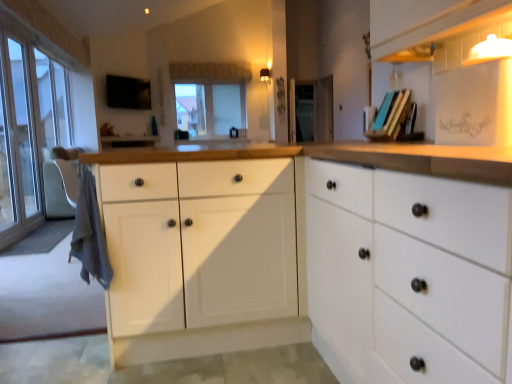
Question: Which direction should I rotate to look at matte black knob at center, which is counted as the third knob, starting from the top?

Choices:
 (A) right
 (B) left

Answer: (A)

Question: Is transparent glass door at left far away from transparent glass screen door at center?

Choices:
 (A) no
 (B) yes

Answer: (B)

Question: Does transparent glass door at left come in front of transparent glass screen door at center?

Choices:
 (A) yes
 (B) no

Answer: (A)

Question: From the image's perspective, is transparent glass door at left on top of transparent glass screen door at center?

Choices:
 (A) no
 (B) yes

Answer: (A)

Question: From the image's perspective, would you say transparent glass door at left is shown under transparent glass screen door at center?

Choices:
 (A) no
 (B) yes

Answer: (B)

Question: Could transparent glass screen door at center be considered to be inside transparent glass door at left?

Choices:
 (A) no
 (B) yes

Answer: (A)

Question: Considering the relative sizes of transparent glass door at left and transparent glass screen door at center in the image provided, is transparent glass door at left bigger than transparent glass screen door at center?

Choices:
 (A) no
 (B) yes

Answer: (B)

Question: Is the surface of metallic black knob at center, which is the first knob in top-to-bottom order, in direct contact with transparent glass door at left?

Choices:
 (A) no
 (B) yes

Answer: (A)

Question: Is metallic black knob at center, which is the first knob in top-to-bottom order, positioned before transparent glass door at left?

Choices:
 (A) yes
 (B) no

Answer: (B)

Question: Can you confirm if metallic black knob at center, which is the third knob from bottom to top, is smaller than transparent glass door at left?

Choices:
 (A) yes
 (B) no

Answer: (A)

Question: Considering the relative positions of metallic black knob at center, which is the third knob from bottom to top, and transparent glass door at left in the image provided, is metallic black knob at center, which is the third knob from bottom to top, to the left of transparent glass door at left from the viewer's perspective?

Choices:
 (A) no
 (B) yes

Answer: (A)

Question: From a real-world perspective, is metallic black knob at center, which is the third knob from bottom to top, on top of transparent glass door at left?

Choices:
 (A) no
 (B) yes

Answer: (B)

Question: Is transparent glass door at left surrounded by metallic black knob at center, which is the first knob in top-to-bottom order?

Choices:
 (A) yes
 (B) no

Answer: (B)

Question: Is transparent glass screen door at center bigger than metallic black knob at center, which is the third knob from bottom to top?

Choices:
 (A) no
 (B) yes

Answer: (B)